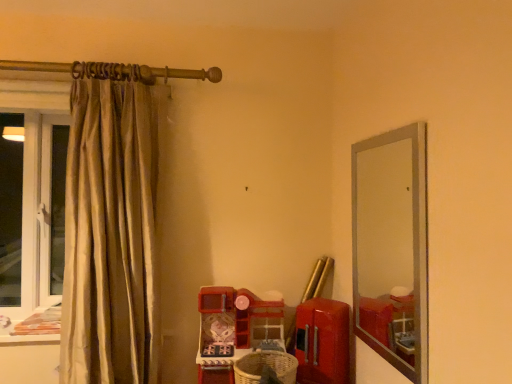
Question: Considering the positions of silky beige curtain at left and woven brown basket at lower center in the image, is silky beige curtain at left taller or shorter than woven brown basket at lower center?

Choices:
 (A) short
 (B) tall

Answer: (B)

Question: Is silky beige curtain at left situated inside woven brown basket at lower center or outside?

Choices:
 (A) outside
 (B) inside

Answer: (A)

Question: Estimate the real-world distances between objects in this image. Which object is farther from the woven brown basket at lower center?

Choices:
 (A) silky beige curtain at left
 (B) clear glass mirror at right

Answer: (A)

Question: Which object is positioned closest to the woven brown basket at lower center?

Choices:
 (A) clear glass mirror at right
 (B) silky beige curtain at left

Answer: (A)